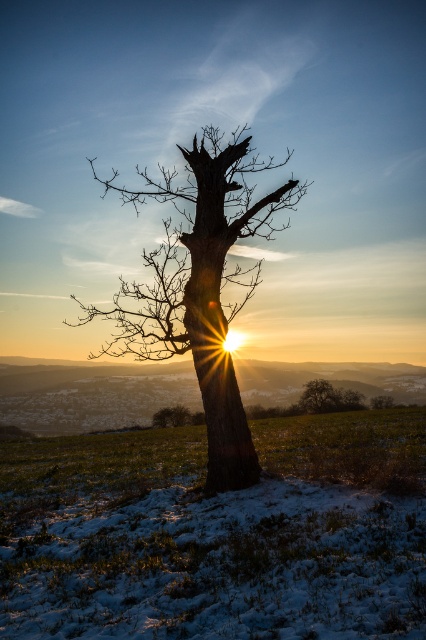
You are an observer standing in front of the tree. Which object is closer to the ground, the snowy grass at center or the smooth bark tree trunk at center?

The snowy grass at center is positioned under the smooth bark tree trunk at center, so the snowy grass at center is closer to the ground.

You are an artist planning to paint the winter landscape. You want to ensure the snowy grass at center and the smooth brown tree trunk at center are positioned correctly in terms of depth. Based on the scene, which object should appear closer to the viewer?

The snowy grass at center is closer to the viewer than the smooth brown tree trunk at center according to the description.

You are an environmental scientist observing the winter landscape. You notice the snowy grass at center and the smooth brown tree trunk at center. Which of these two features covers a larger area in the scene?

The snowy grass at center is bigger than the smooth brown tree trunk at center, so the snowy grass at center covers a larger area in the scene.